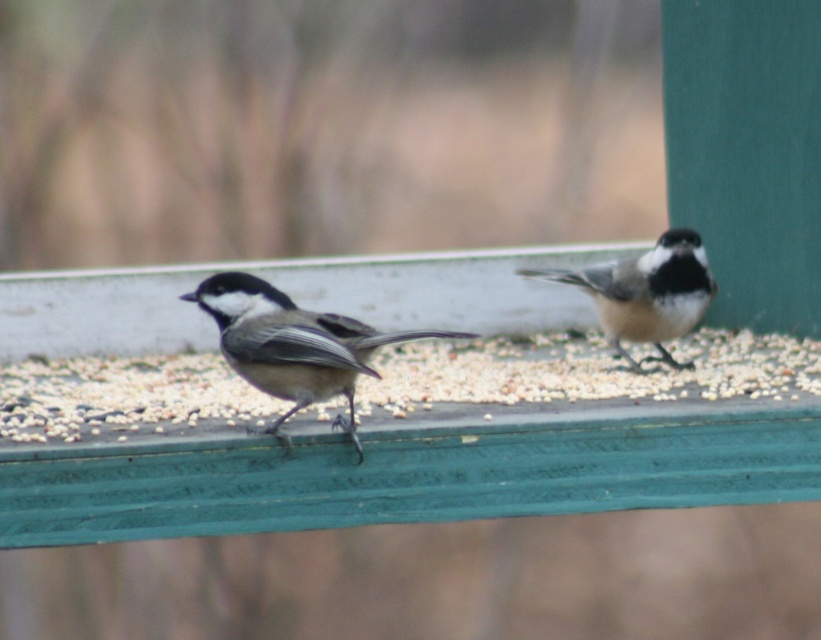
You are a photographer aiming to capture a closeup of the gray matte bird at center. Given that your camera can focus on subjects within 1 meter, will you be able to achieve a clear closeup without moving the bird?

The gray matte bird at center is 1.39 meters away from the camera, which is beyond the camera focus range of 1 meter. Therefore, you will not be able to achieve a clear closeup without moving the bird closer.

You are a photographer aiming to capture a closeup of the gray matte bird at center. Given that your camera focuses at the center point of the image, which is at coordinate point 0.5, 0.5, will the bird be in focus?

The gray matte bird at center is at point (292, 346), which is slightly off the center point of (410, 320). Therefore, the bird may not be in focus if the camera focuses only at the exact center point.

You are a birdwatcher trying to identify two birds on a feeder. You notice a gray matte bird at center and a white speckled feathers at center. Which bird is located to the left?

The gray matte bird at center is positioned to the left of the white speckled feathers at center.